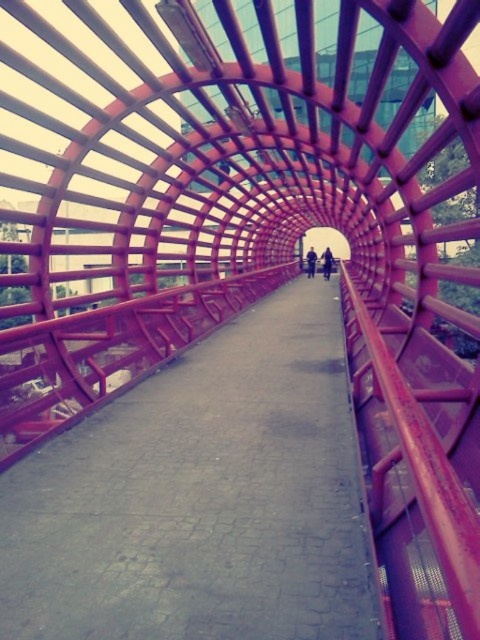
Question: Estimate the real-world distances between objects in this image. Which object is farther from the metallic pink walkway at center?

Choices:
 (A) dark blue jeans at center
 (B) dark blue jacket at center

Answer: (B)

Question: Does metallic pink walkway at center have a greater width compared to dark blue jacket at center?

Choices:
 (A) yes
 (B) no

Answer: (A)

Question: Does metallic pink walkway at center have a greater width compared to dark blue jeans at center?

Choices:
 (A) no
 (B) yes

Answer: (B)

Question: Is metallic pink walkway at center smaller than dark blue jacket at center?

Choices:
 (A) yes
 (B) no

Answer: (B)

Question: Which object is the closest to the metallic pink walkway at center?

Choices:
 (A) dark blue jeans at center
 (B) dark blue jacket at center

Answer: (A)

Question: Which of the following is the closest to the observer?

Choices:
 (A) (311, 246)
 (B) (191, 480)

Answer: (B)